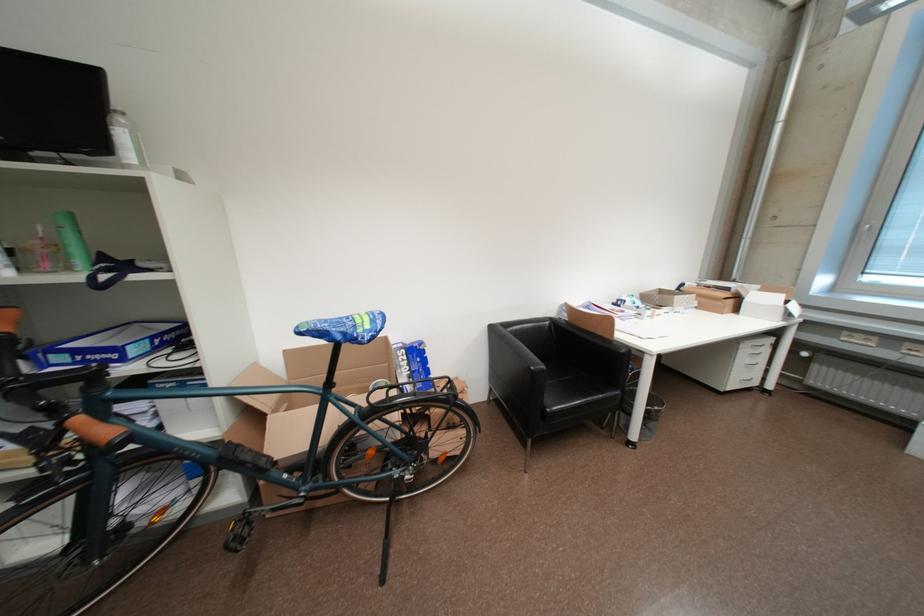
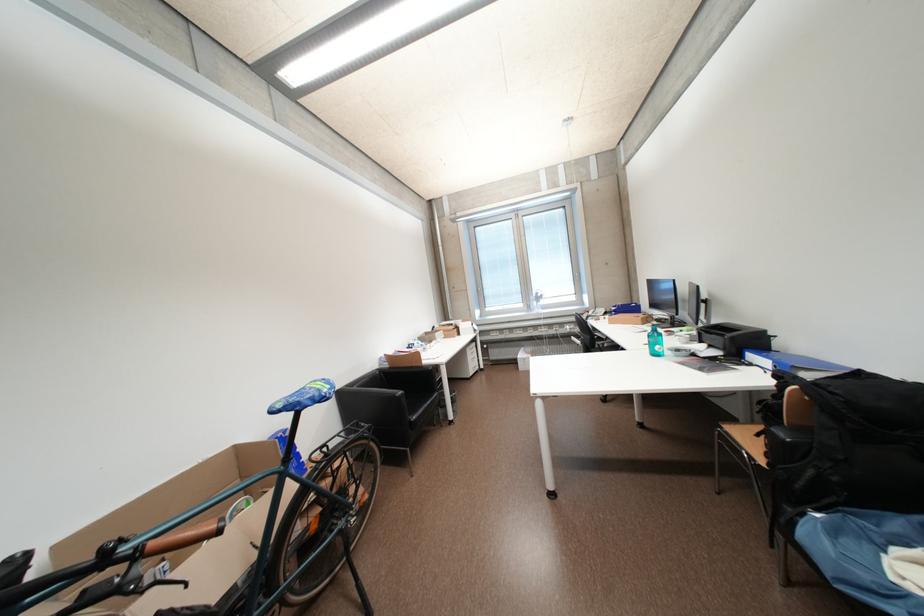
Where in the second image is the point corresponding to point 608,334 from the first image?

(421, 367)